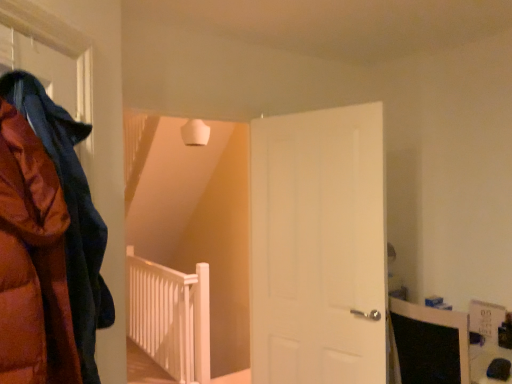
Question: Can you confirm if matte orange puffer jacket at left is wider than white wooden rail at center?

Choices:
 (A) yes
 (B) no

Answer: (A)

Question: From a real-world perspective, is matte orange puffer jacket at left physically above white wooden rail at center?

Choices:
 (A) no
 (B) yes

Answer: (B)

Question: Is matte orange puffer jacket at left oriented away from white wooden rail at center?

Choices:
 (A) yes
 (B) no

Answer: (B)

Question: Considering the relative sizes of matte orange puffer jacket at left and white wooden rail at center in the image provided, is matte orange puffer jacket at left shorter than white wooden rail at center?

Choices:
 (A) no
 (B) yes

Answer: (B)

Question: Is matte orange puffer jacket at left smaller than white wooden rail at center?

Choices:
 (A) no
 (B) yes

Answer: (B)

Question: Is matte orange puffer jacket at left at the right side of white wooden rail at center?

Choices:
 (A) no
 (B) yes

Answer: (B)

Question: Is matte orange puffer jacket at left located outside white matte door at center?

Choices:
 (A) yes
 (B) no

Answer: (A)

Question: From the image's perspective, would you say matte orange puffer jacket at left is shown under white matte door at center?

Choices:
 (A) yes
 (B) no

Answer: (B)

Question: Considering the relative sizes of matte orange puffer jacket at left and white matte door at center in the image provided, is matte orange puffer jacket at left shorter than white matte door at center?

Choices:
 (A) no
 (B) yes

Answer: (B)

Question: From a real-world perspective, is matte orange puffer jacket at left located beneath white matte door at center?

Choices:
 (A) no
 (B) yes

Answer: (A)

Question: Does matte orange puffer jacket at left turn towards white matte door at center?

Choices:
 (A) yes
 (B) no

Answer: (B)

Question: Is matte orange puffer jacket at left facing away from white matte door at center?

Choices:
 (A) no
 (B) yes

Answer: (A)

Question: Is white matte door at center next to white wooden rail at center?

Choices:
 (A) no
 (B) yes

Answer: (A)